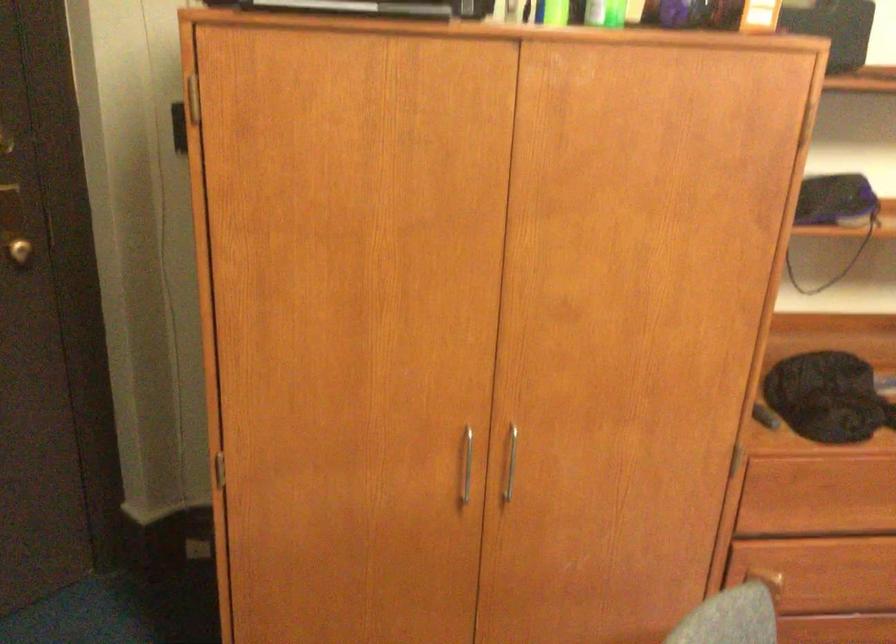
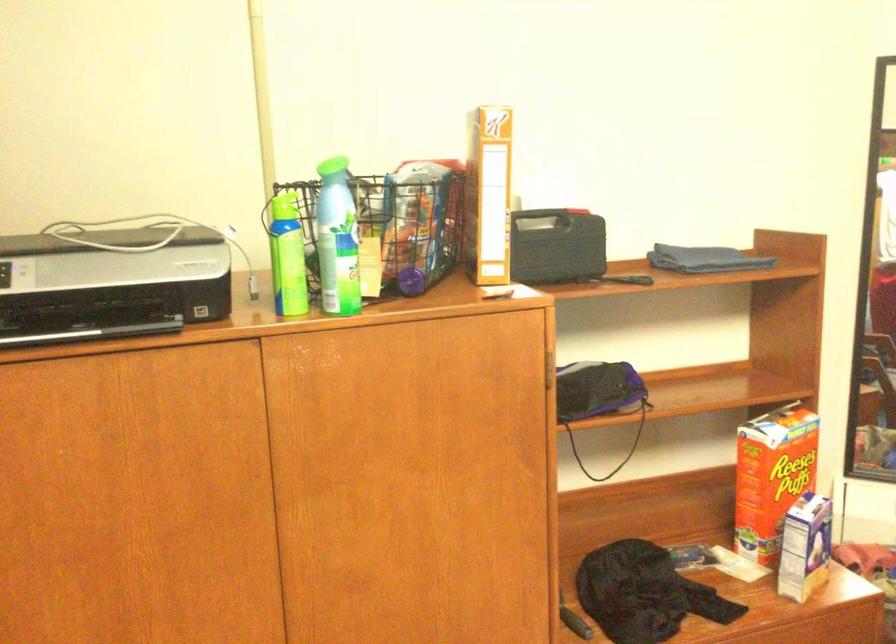
Question: The first image is from the beginning of the video and the second image is from the end. How did the camera likely rotate when shooting the video?

Choices:
 (A) Left
 (B) Right
 (C) Up
 (D) Down

Answer: (B)